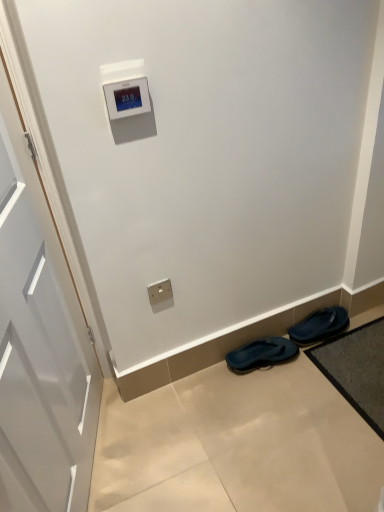
Question: Based on their positions, is satin gold outlet at lower center located to the left or right of dark gray textured bath mat at lower right?

Choices:
 (A) left
 (B) right

Answer: (A)

Question: Considering the positions of satin gold outlet at lower center and dark gray textured bath mat at lower right in the image, is satin gold outlet at lower center bigger or smaller than dark gray textured bath mat at lower right?

Choices:
 (A) small
 (B) big

Answer: (A)

Question: Estimate the real-world distances between objects in this image. Which object is farther from the beige tile floor at lower center?

Choices:
 (A) dark blue rubber flip-flops at lower right, the second footwear from the right
 (B) black rubber slippers at lower right, placed as the 2th footwear when sorted from left to right
 (C) satin gold outlet at lower center
 (D) dark gray textured bath mat at lower right

Answer: (C)

Question: Which of these objects is positioned closest to the dark gray textured bath mat at lower right?

Choices:
 (A) dark blue rubber flip-flops at lower right, the 1th footwear viewed from the left
 (B) black rubber slippers at lower right, the first footwear when ordered from right to left
 (C) satin gold outlet at lower center
 (D) beige tile floor at lower center

Answer: (B)